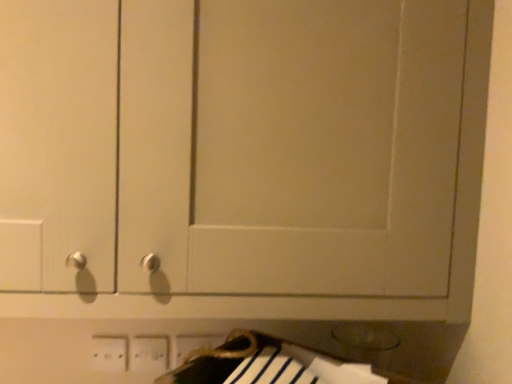
Question: Is white plastic electric outlet at lower center, which appears as the first electric outlet when viewed from the right, outside white plastic electric outlet at lower center, which is counted as the 1th electric outlet, starting from the left?

Choices:
 (A) yes
 (B) no

Answer: (A)

Question: From a real-world perspective, is white plastic electric outlet at lower center, which appears as the first electric outlet when viewed from the right, on top of white plastic electric outlet at lower center, arranged as the 3th electric outlet when viewed from the right?

Choices:
 (A) no
 (B) yes

Answer: (B)

Question: From the image's perspective, is white plastic electric outlet at lower center, which appears as the first electric outlet when viewed from the right, under white plastic electric outlet at lower center, arranged as the 3th electric outlet when viewed from the right?

Choices:
 (A) yes
 (B) no

Answer: (A)

Question: Is white plastic electric outlet at lower center, which appears as the first electric outlet when viewed from the right, bigger than white plastic electric outlet at lower center, which is counted as the 1th electric outlet, starting from the left?

Choices:
 (A) no
 (B) yes

Answer: (B)

Question: From a real-world perspective, is white plastic electric outlet at lower center, which appears as the first electric outlet when viewed from the right, physically below white plastic electric outlet at lower center, which is counted as the 1th electric outlet, starting from the left?

Choices:
 (A) yes
 (B) no

Answer: (B)

Question: From their relative heights in the image, would you say white plastic electric outlet at lower center, acting as the 2th electric outlet starting from the right, is taller or shorter than white plastic electric outlet at lower center, which ranks as the 3th electric outlet in left-to-right order?

Choices:
 (A) tall
 (B) short

Answer: (A)

Question: From the image's perspective, is white plastic electric outlet at lower center, acting as the 2th electric outlet starting from the right, positioned above or below white plastic electric outlet at lower center, which ranks as the 3th electric outlet in left-to-right order?

Choices:
 (A) above
 (B) below

Answer: (A)

Question: Is white plastic electric outlet at lower center, acting as the 2th electric outlet starting from the left, in front of or behind white plastic electric outlet at lower center, which appears as the first electric outlet when viewed from the right, in the image?

Choices:
 (A) front
 (B) behind

Answer: (A)

Question: Based on their positions, is white plastic electric outlet at lower center, acting as the 2th electric outlet starting from the left, located to the left or right of white plastic electric outlet at lower center, which ranks as the 3th electric outlet in left-to-right order?

Choices:
 (A) right
 (B) left

Answer: (B)

Question: From a real-world perspective, is white plastic electric outlet at lower center, acting as the 2th electric outlet starting from the right, positioned above or below white plastic electric outlet at lower center, which is counted as the 1th electric outlet, starting from the left?

Choices:
 (A) below
 (B) above

Answer: (B)

Question: Is white plastic electric outlet at lower center, acting as the 2th electric outlet starting from the right, wider or thinner than white plastic electric outlet at lower center, arranged as the 3th electric outlet when viewed from the right?

Choices:
 (A) thin
 (B) wide

Answer: (B)

Question: Based on their sizes in the image, would you say white plastic electric outlet at lower center, acting as the 2th electric outlet starting from the right, is bigger or smaller than white plastic electric outlet at lower center, which is counted as the 1th electric outlet, starting from the left?

Choices:
 (A) big
 (B) small

Answer: (A)

Question: Is white plastic electric outlet at lower center, acting as the 2th electric outlet starting from the left, inside or outside of white plastic electric outlet at lower center, arranged as the 3th electric outlet when viewed from the right?

Choices:
 (A) outside
 (B) inside

Answer: (A)

Question: From a real-world perspective, is white plastic electric outlet at lower center, which is counted as the 1th electric outlet, starting from the left, positioned above or below white plastic electric outlet at lower center, acting as the 2th electric outlet starting from the left?

Choices:
 (A) below
 (B) above

Answer: (A)

Question: From the image's perspective, relative to white plastic electric outlet at lower center, acting as the 2th electric outlet starting from the left, is white plastic electric outlet at lower center, arranged as the 3th electric outlet when viewed from the right, above or below?

Choices:
 (A) above
 (B) below

Answer: (A)